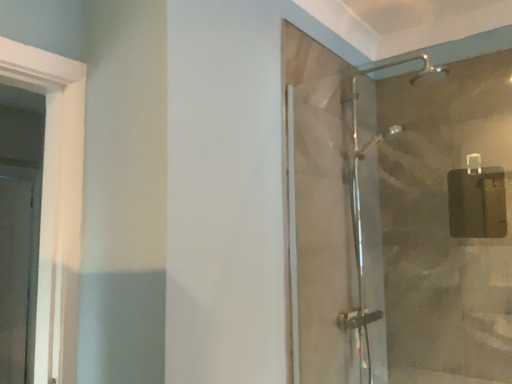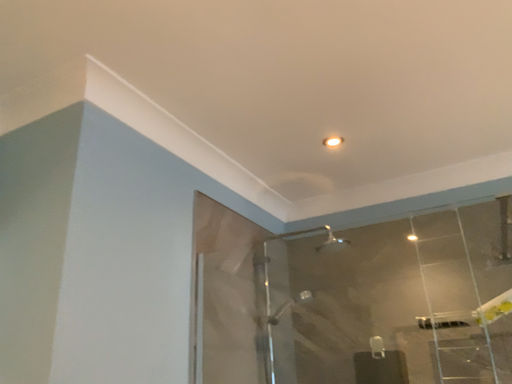
Question: How did the camera likely rotate when shooting the video?

Choices:
 (A) rotated right
 (B) rotated left

Answer: (A)